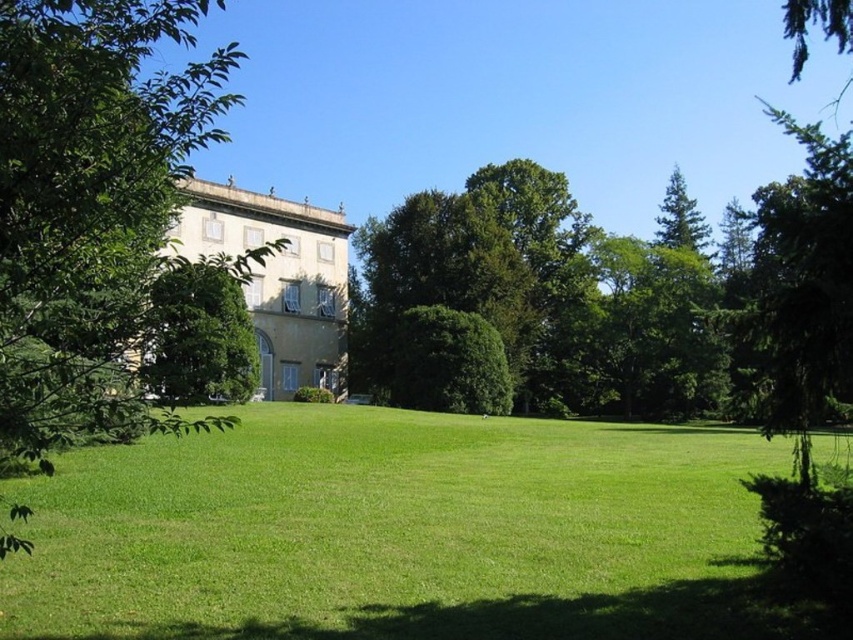
Question: Does green leafy tree at left appear on the right side of green leafy tree at right?

Choices:
 (A) no
 (B) yes

Answer: (A)

Question: Does green leafy tree at left appear on the right side of green leafy tree at right?

Choices:
 (A) yes
 (B) no

Answer: (B)

Question: Which object appears closest to the camera in this image?

Choices:
 (A) green grass at center
 (B) green leafy tree at left

Answer: (B)

Question: Can you confirm if green grass at center is bigger than green leafy tree at left?

Choices:
 (A) no
 (B) yes

Answer: (A)

Question: Based on their relative distances, which object is nearer to the green leafy tree at left?

Choices:
 (A) green grass at center
 (B) green leafy tree at right

Answer: (A)

Question: Which object appears farthest from the camera in this image?

Choices:
 (A) green grass at center
 (B) green leafy tree at right

Answer: (B)